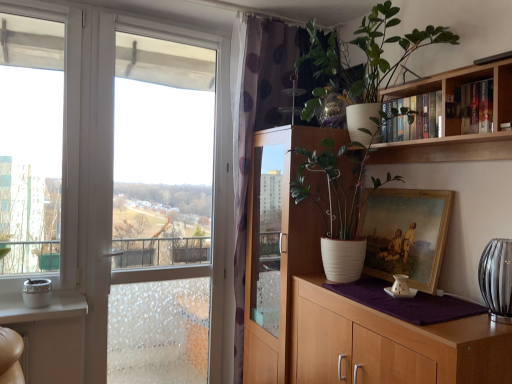
Question: Is white ceramic pot at upper right, which is the second houseplant from top to bottom, facing away from wooden cabinet at right, acting as the second cabinetry starting from the back?

Choices:
 (A) no
 (B) yes

Answer: (A)

Question: Is white ceramic pot at upper right, which ranks as the 1th houseplant in bottom-to-top order, touching wooden cabinet at right, positioned as the first cabinetry in front-to-back order?

Choices:
 (A) yes
 (B) no

Answer: (B)

Question: Can you confirm if white ceramic pot at upper right, which is the second houseplant from top to bottom, is wider than wooden cabinet at right, acting as the second cabinetry starting from the back?

Choices:
 (A) no
 (B) yes

Answer: (B)

Question: Can you confirm if white ceramic pot at upper right, which ranks as the 1th houseplant in bottom-to-top order, is smaller than wooden cabinet at right, positioned as the first cabinetry in front-to-back order?

Choices:
 (A) no
 (B) yes

Answer: (B)

Question: Can you confirm if white ceramic pot at upper right, which ranks as the 1th houseplant in bottom-to-top order, is positioned to the right of wooden cabinet at right, acting as the second cabinetry starting from the back?

Choices:
 (A) no
 (B) yes

Answer: (A)

Question: From the image's perspective, is white ceramic pot at upper right, which is the second houseplant from top to bottom, over wooden cabinet at right, acting as the second cabinetry starting from the back?

Choices:
 (A) yes
 (B) no

Answer: (A)

Question: From the image's perspective, would you say translucent glass vase at right is shown under wooden bookshelf at upper right?

Choices:
 (A) no
 (B) yes

Answer: (B)

Question: Does translucent glass vase at right come behind wooden bookshelf at upper right?

Choices:
 (A) yes
 (B) no

Answer: (A)

Question: Is translucent glass vase at right facing away from wooden bookshelf at upper right?

Choices:
 (A) yes
 (B) no

Answer: (B)

Question: Considering the relative sizes of translucent glass vase at right and wooden bookshelf at upper right in the image provided, is translucent glass vase at right taller than wooden bookshelf at upper right?

Choices:
 (A) no
 (B) yes

Answer: (B)

Question: Considering the relative sizes of translucent glass vase at right and wooden bookshelf at upper right in the image provided, is translucent glass vase at right shorter than wooden bookshelf at upper right?

Choices:
 (A) yes
 (B) no

Answer: (B)

Question: Does translucent glass vase at right appear on the left side of wooden bookshelf at upper right?

Choices:
 (A) yes
 (B) no

Answer: (B)

Question: Can you confirm if wooden bookshelf at upper right is bigger than translucent glass vase at right?

Choices:
 (A) no
 (B) yes

Answer: (A)